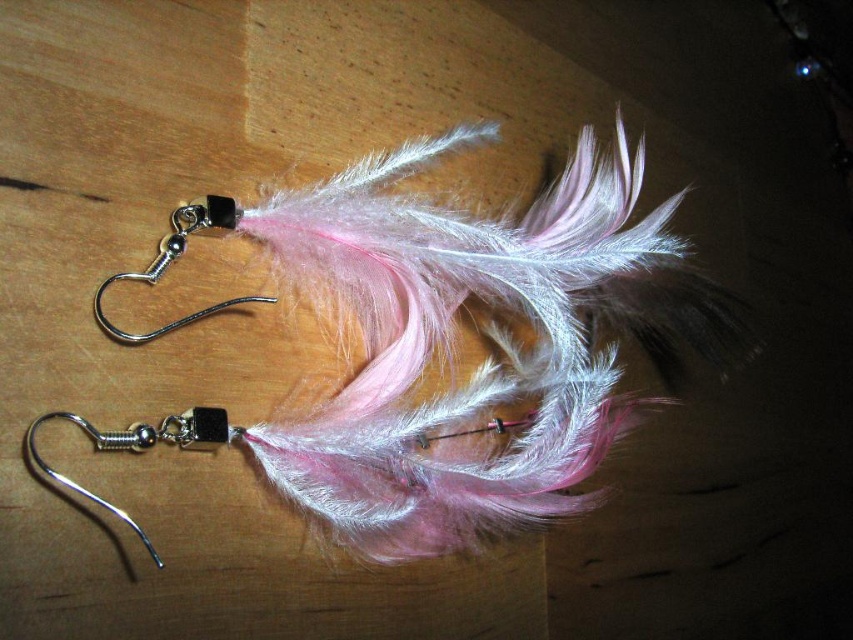
Is silver/metallic hook at lower left behind silver/black metal hook at upper left?

No, it is in front of silver/black metal hook at upper left.

This screenshot has height=640, width=853. I want to click on silver/metallic hook at lower left, so click(x=137, y=448).

You are a GUI agent. You are given a task and a screenshot of the screen. Output one action in this format:
    pyautogui.click(x=<x>, y=<y>)
    Task: Click on the silver/metallic hook at lower left
    The image size is (853, 640).
    Given the screenshot: What is the action you would take?
    pyautogui.click(x=137, y=448)